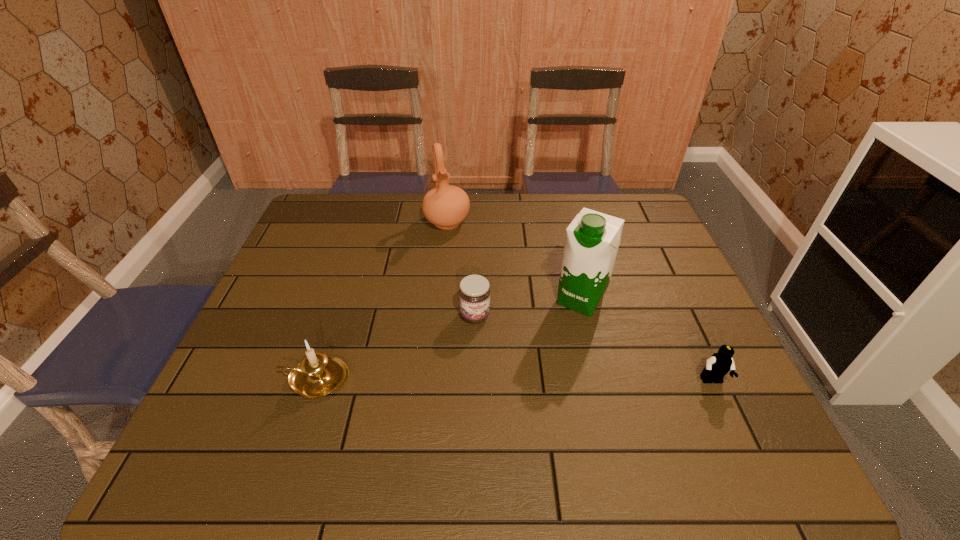
Where is `vacant space positioned 0.360m on the front-facing side of the soya milk`? The width and height of the screenshot is (960, 540). vacant space positioned 0.360m on the front-facing side of the soya milk is located at coordinates (503, 423).

The width and height of the screenshot is (960, 540). What are the coordinates of `vacant area situated 0.050m on the front-facing side of the soya milk` in the screenshot? It's located at (563, 329).

The width and height of the screenshot is (960, 540). I want to click on free location located on the front label of the jam, so click(x=507, y=394).

At what (x,y) coordinates should I click in order to perform the action: click on vacant area located 0.060m on the front label of the jam. Please return your answer as a coordinate pair (x, y). Looking at the image, I should click on (487, 343).

The image size is (960, 540). In order to click on free space located 0.120m on the front label of the jam in this screenshot , I will do `click(494, 362)`.

Where is `vacant space situated on the spout of the farthest object`? This screenshot has width=960, height=540. vacant space situated on the spout of the farthest object is located at coordinates (475, 315).

In order to click on free space located on the spout of the farthest object in this screenshot , I will do `click(459, 263)`.

At what (x,y) coordinates should I click in order to perform the action: click on free space located 0.280m on the spout of the farthest object. Please return your answer as a coordinate pair (x, y). Image resolution: width=960 pixels, height=540 pixels. Looking at the image, I should click on (468, 294).

Locate an element on the screen. The height and width of the screenshot is (540, 960). object present at the far edge is located at coordinates (445, 206).

What are the coordinates of `candle holder located in the near edge section of the desktop` in the screenshot? It's located at (317, 375).